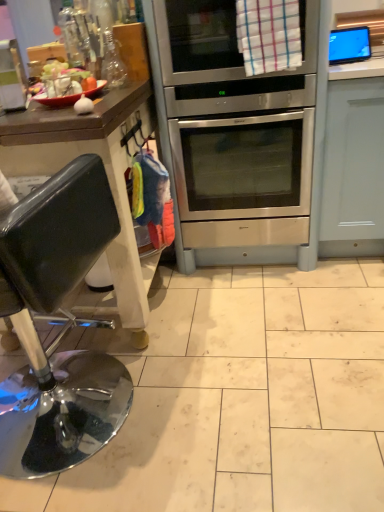
Question: Does stainless steel oven at center turn towards shiny black stool at left?

Choices:
 (A) yes
 (B) no

Answer: (A)

Question: Is stainless steel oven at center turned away from shiny black stool at left?

Choices:
 (A) no
 (B) yes

Answer: (A)

Question: Is the position of stainless steel oven at center less distant than that of shiny black stool at left?

Choices:
 (A) yes
 (B) no

Answer: (B)

Question: Does stainless steel oven at center have a greater height compared to shiny black stool at left?

Choices:
 (A) no
 (B) yes

Answer: (A)

Question: Can you confirm if stainless steel oven at center is positioned to the right of shiny black stool at left?

Choices:
 (A) yes
 (B) no

Answer: (A)

Question: Is shiny black stool at left inside the boundaries of stainless steel oven at center, or outside?

Choices:
 (A) inside
 (B) outside

Answer: (B)

Question: In terms of width, does shiny black stool at left look wider or thinner when compared to stainless steel oven at center?

Choices:
 (A) thin
 (B) wide

Answer: (A)

Question: From a real-world perspective, is shiny black stool at left positioned above or below stainless steel oven at center?

Choices:
 (A) above
 (B) below

Answer: (A)

Question: Is shiny black stool at left bigger or smaller than stainless steel oven at center?

Choices:
 (A) big
 (B) small

Answer: (A)

Question: Considering the positions of matte glass bowl at upper left and shiny black stool at left in the image, is matte glass bowl at upper left wider or thinner than shiny black stool at left?

Choices:
 (A) thin
 (B) wide

Answer: (A)

Question: Relative to shiny black stool at left, is matte glass bowl at upper left in front or behind?

Choices:
 (A) behind
 (B) front

Answer: (A)

Question: Considering the relative positions of matte glass bowl at upper left and shiny black stool at left in the image provided, is matte glass bowl at upper left to the left or to the right of shiny black stool at left?

Choices:
 (A) left
 (B) right

Answer: (B)

Question: From the image's perspective, relative to shiny black stool at left, is matte glass bowl at upper left above or below?

Choices:
 (A) below
 (B) above

Answer: (B)

Question: From a real-world perspective, is stainless steel oven at center above or below matte glass bowl at upper left?

Choices:
 (A) below
 (B) above

Answer: (A)

Question: Considering the positions of point (192, 138) and point (100, 81), is point (192, 138) closer or farther from the camera than point (100, 81)?

Choices:
 (A) closer
 (B) farther

Answer: (B)